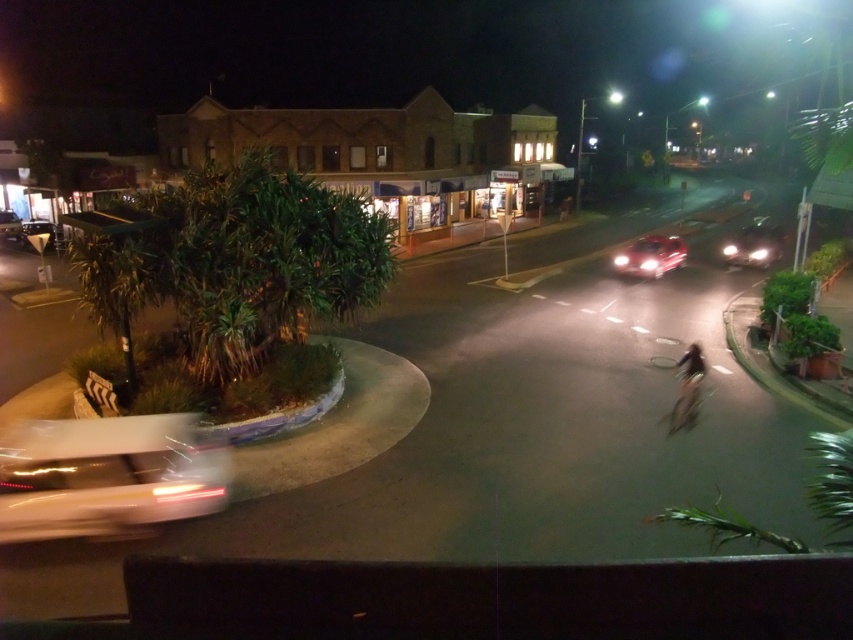
Question: Can you confirm if white glossy car at lower left is positioned to the left of dark fabric bicycle at center-right?

Choices:
 (A) no
 (B) yes

Answer: (B)

Question: Is matte silver car at right closer to the viewer compared to shiny metallic bicycle at center-right?

Choices:
 (A) no
 (B) yes

Answer: (A)

Question: Which object is the farthest from the matte silver car at right?

Choices:
 (A) glossy red car at center
 (B) shiny metallic bicycle at center-right
 (C) white glossy car at lower left

Answer: (C)

Question: Which object is farther from the camera taking this photo?

Choices:
 (A) matte silver car at right
 (B) shiny metallic bicycle at center-right
 (C) white glossy car at lower left

Answer: (A)

Question: Considering the real-world distances, which object is closest to the white glossy car at lower left?

Choices:
 (A) matte silver car at right
 (B) dark fabric bicycle at center-right
 (C) glossy red car at center

Answer: (B)

Question: Observing the image, what is the correct spatial positioning of dark fabric bicycle at center-right in reference to shiny metallic bicycle at center-right?

Choices:
 (A) above
 (B) below

Answer: (A)